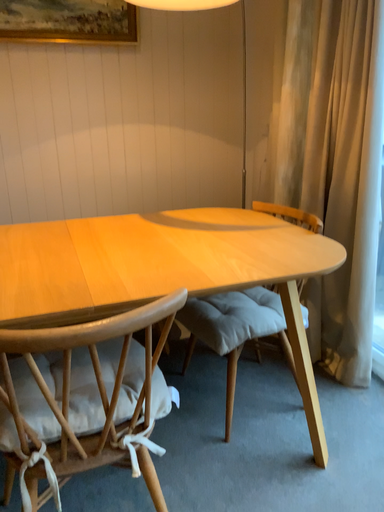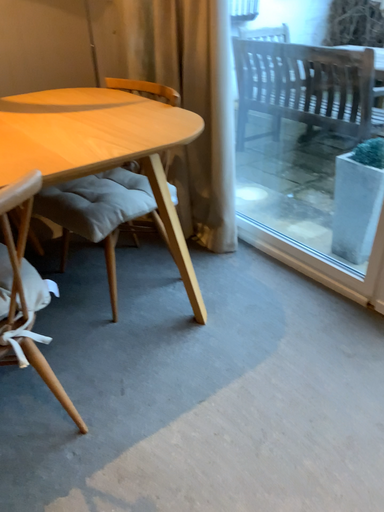
Question: How did the camera likely rotate when shooting the video?

Choices:
 (A) rotated right
 (B) rotated left

Answer: (A)